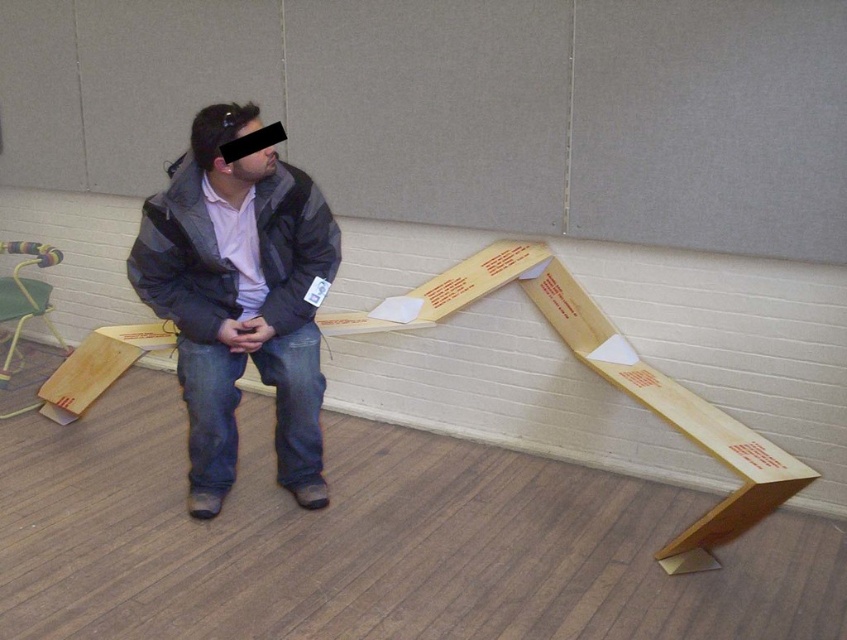
Who is lower down, dark gray jacket at center or multicolored plastic stool at left?

Positioned lower is multicolored plastic stool at left.

Is point (266, 323) behind point (0, 323)?

That is False.

Image resolution: width=847 pixels, height=640 pixels. I want to click on dark gray jacket at center, so click(x=241, y=298).

Is point (220, 314) more distant than point (154, 278)?

Yes, it is.

How far apart are dark gray jacket at center and striped fabric jacket at center?

dark gray jacket at center is 8.89 centimeters from striped fabric jacket at center.

This screenshot has height=640, width=847. I want to click on dark gray jacket at center, so click(241, 298).

Is striped fabric jacket at center further to the viewer compared to multicolored plastic stool at left?

No, striped fabric jacket at center is in front of multicolored plastic stool at left.

Can you confirm if striped fabric jacket at center is shorter than multicolored plastic stool at left?

Correct, striped fabric jacket at center is not as tall as multicolored plastic stool at left.

Is point (235, 316) positioned behind point (48, 312)?

No, it is in front of (48, 312).

Locate an element on the screen. Image resolution: width=847 pixels, height=640 pixels. striped fabric jacket at center is located at coordinates (181, 259).